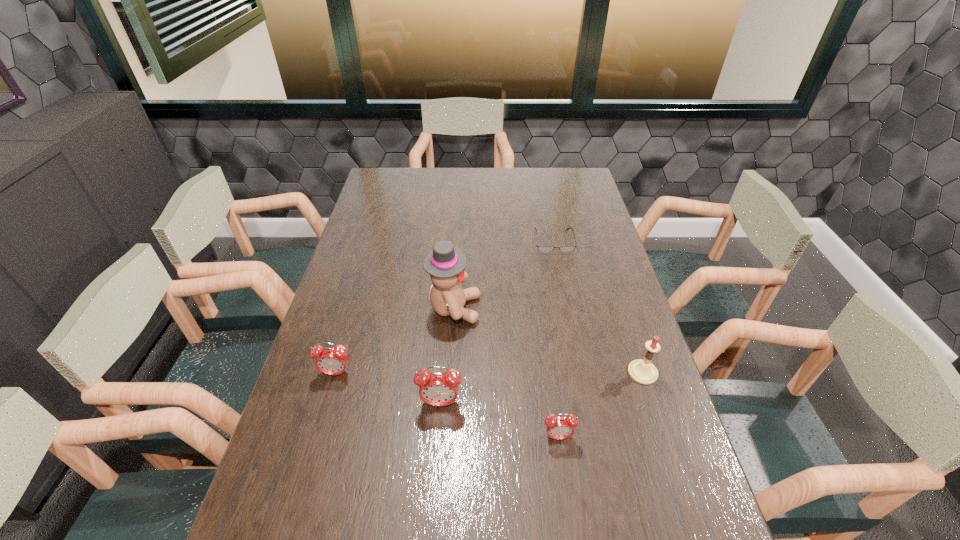
This screenshot has height=540, width=960. I want to click on vacant region at the far edge of the desktop, so click(x=452, y=171).

In the image, there is a desktop. Find the location of `free space at the near edge`. free space at the near edge is located at coordinates (536, 524).

Where is `free spot at the left edge of the desktop`? free spot at the left edge of the desktop is located at coordinates (401, 203).

Locate an element on the screen. This screenshot has width=960, height=540. vacant space at the right edge of the desktop is located at coordinates (584, 308).

You are a GUI agent. You are given a task and a screenshot of the screen. Output one action in this format:
    pyautogui.click(x=<x>, y=<y>)
    Task: Click on the free location at the far left corner of the desktop
    The image size is (960, 540).
    Given the screenshot: What is the action you would take?
    pyautogui.click(x=381, y=176)

Identify the location of vacant point at the far right corner. (558, 181).

The image size is (960, 540). Find the location of `unoccupied area between the farthest alarm clock and the tallest object`. unoccupied area between the farthest alarm clock and the tallest object is located at coordinates [x=395, y=341].

At what (x,y) coordinates should I click in order to perform the action: click on unoccupied area between the rightmost alarm clock and the fifth nearest object. Please return your answer as a coordinate pair (x, y). Looking at the image, I should click on (506, 373).

You are a GUI agent. You are given a task and a screenshot of the screen. Output one action in this format:
    pyautogui.click(x=<x>, y=<y>)
    Task: Click on the vacant point located between the shortest alarm clock and the farthest object
    The width and height of the screenshot is (960, 540).
    Given the screenshot: What is the action you would take?
    pyautogui.click(x=556, y=339)

Locate an element on the screen. Image resolution: width=960 pixels, height=540 pixels. unoccupied area between the rightmost object and the nearest object is located at coordinates (600, 404).